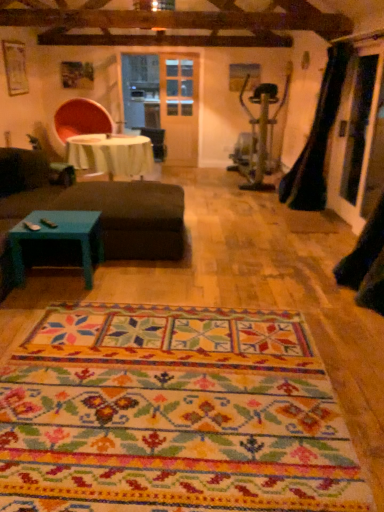
Question: From their relative heights in the image, would you say dark brown fabric ottoman at center is taller or shorter than teal painted wood coffee table at lower left?

Choices:
 (A) tall
 (B) short

Answer: (A)

Question: Is dark brown fabric ottoman at center inside the boundaries of teal painted wood coffee table at lower left, or outside?

Choices:
 (A) inside
 (B) outside

Answer: (B)

Question: Which object is positioned closest to the black leather guitar case at right?

Choices:
 (A) multicolored woven mat at center
 (B) white fabric table at center
 (C) dark brown fabric ottoman at center
 (D) teal painted wood coffee table at lower left
 (E) transparent glass door at right

Answer: (E)

Question: Which object is positioned farthest from the black leather guitar case at right?

Choices:
 (A) dark brown fabric ottoman at center
 (B) teal painted wood coffee table at lower left
 (C) transparent glass door at right
 (D) multicolored woven mat at center
 (E) white fabric table at center

Answer: (D)